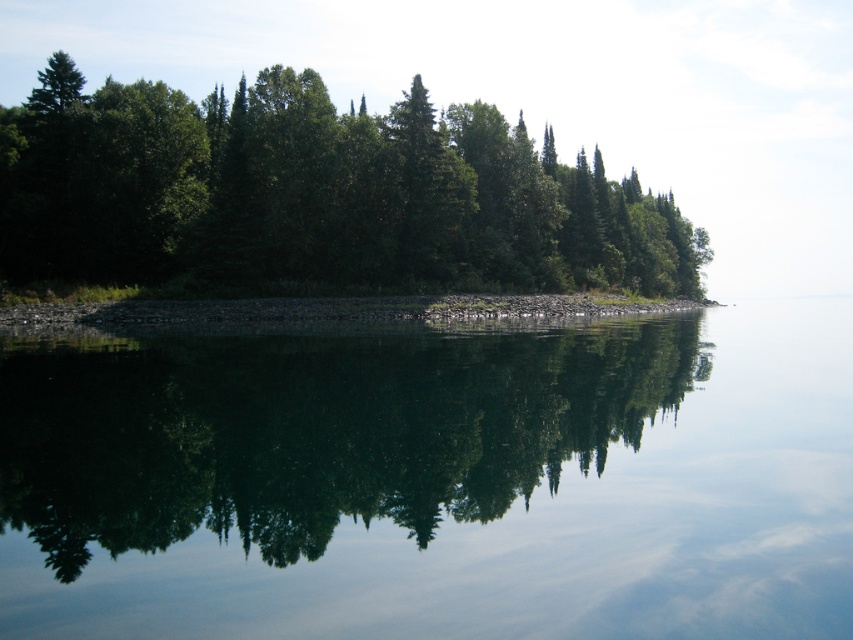
Does green leafy trees at center appear on the left side of gray gravel shoreline at center?

Correct, you'll find green leafy trees at center to the left of gray gravel shoreline at center.

Is point (154, 218) positioned in front of point (331, 312)?

No, it is behind (331, 312).

Is point (672, 257) in front of point (683, 300)?

Yes, it is in front of point (683, 300).

In order to click on green leafy trees at center in this screenshot , I will do `click(314, 195)`.

Between point (222, 385) and point (44, 305), which one is positioned in front?

Point (222, 385) is more forward.

Which is more to the left, transparent water at center or gray gravel shoreline at center?

transparent water at center is more to the left.

Describe the element at coordinates (434, 481) in the screenshot. Image resolution: width=853 pixels, height=640 pixels. I see `transparent water at center` at that location.

Find the location of a particular element. transparent water at center is located at coordinates (434, 481).

Between transparent water at center and green leafy trees at center, which one has less height?

transparent water at center

Is transparent water at center above green leafy trees at center?

Actually, transparent water at center is below green leafy trees at center.

Describe the element at coordinates (434, 481) in the screenshot. The height and width of the screenshot is (640, 853). I see `transparent water at center` at that location.

Where is `transparent water at center`? transparent water at center is located at coordinates 434,481.